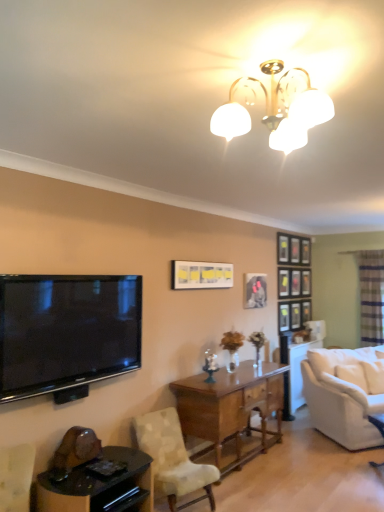
Where is `vacant area that lies to the right of mahogany wood desk at center`? vacant area that lies to the right of mahogany wood desk at center is located at coordinates (333, 471).